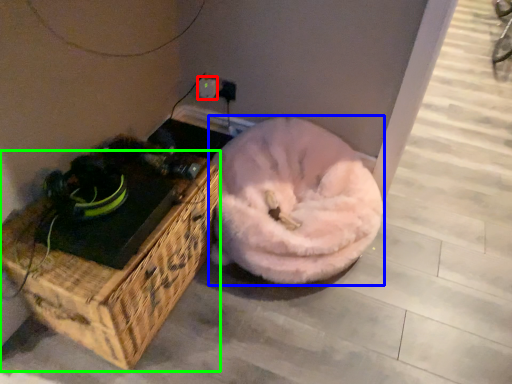
Question: Which object is the farthest from electric outlet (highlighted by a red box)? Choose among these: dog bed (highlighted by a blue box) or furniture (highlighted by a green box).

Choices:
 (A) dog bed
 (B) furniture

Answer: (B)